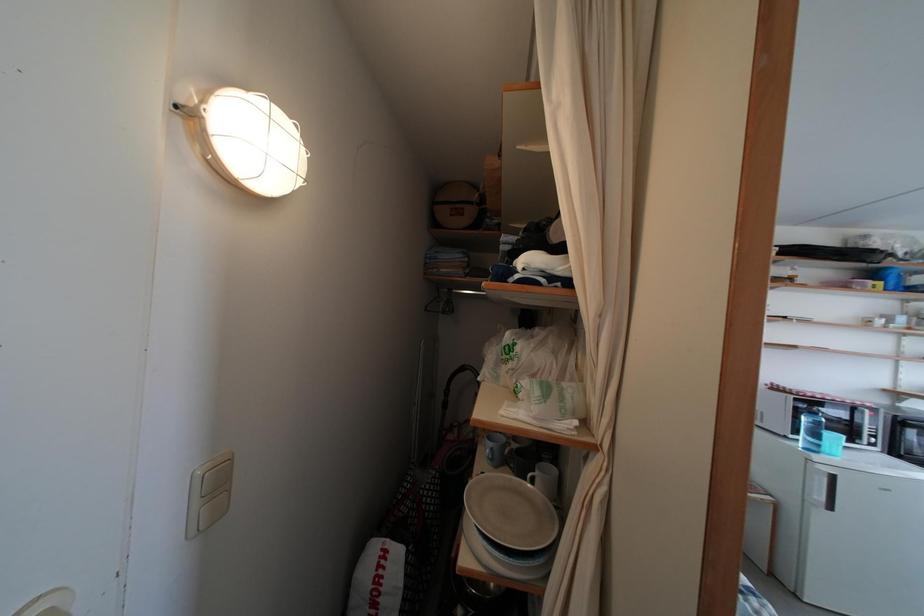
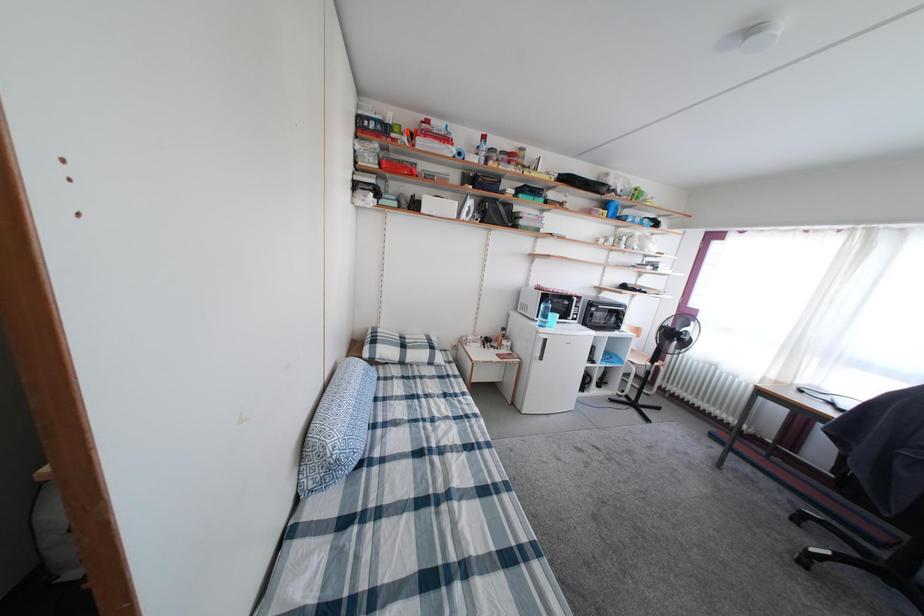
Question: Which direction would the cameraman need to move to produce the second image? Reply with the corresponding letter.

Choices:
 (A) Left
 (B) Right
 (C) Forward
 (D) Backward

Answer: (B)